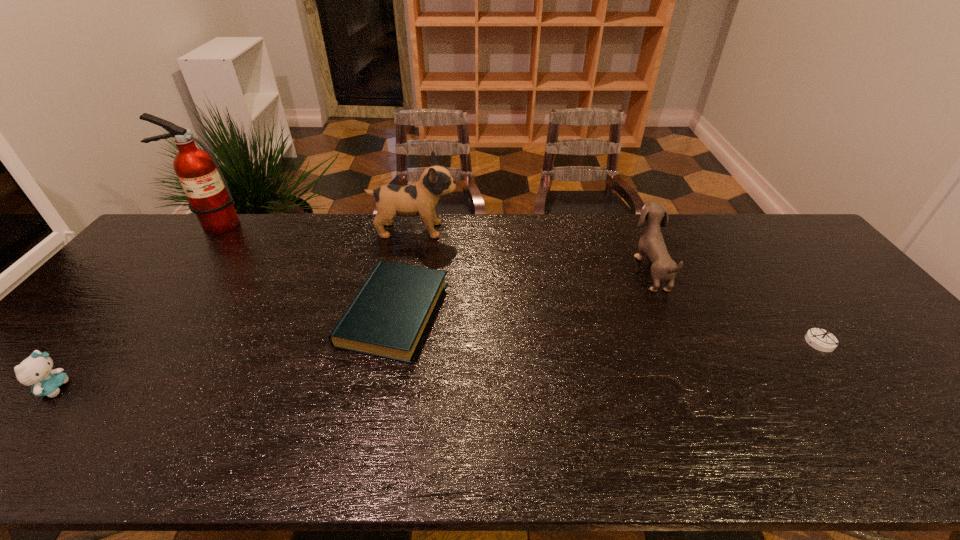
What are the coordinates of `free space located at the face of the second tallest object` in the screenshot? It's located at (560, 230).

Image resolution: width=960 pixels, height=540 pixels. What are the coordinates of `free space located at the face of the second object from right to left` in the screenshot? It's located at (585, 269).

Where is `vacant space located 0.230m at the face of the second object from right to left`? vacant space located 0.230m at the face of the second object from right to left is located at coordinates (563, 269).

Locate an element on the screen. vacant space positioned at the face of the second object from right to left is located at coordinates (598, 269).

Image resolution: width=960 pixels, height=540 pixels. In order to click on vacant space located on the face of the nearest object in this screenshot , I will do `click(114, 388)`.

Where is `free spot located on the right of the book`? Image resolution: width=960 pixels, height=540 pixels. free spot located on the right of the book is located at coordinates (525, 313).

Where is `free space located on the front of the rightmost object`? The image size is (960, 540). free space located on the front of the rightmost object is located at coordinates (873, 411).

This screenshot has width=960, height=540. I want to click on fire extinguisher that is at the far edge, so click(x=209, y=197).

Where is `fire extinguisher located in the left edge section of the desktop`? The height and width of the screenshot is (540, 960). fire extinguisher located in the left edge section of the desktop is located at coordinates (209, 197).

This screenshot has height=540, width=960. What are the coordinates of `kitten that is at the left edge` in the screenshot? It's located at (36, 370).